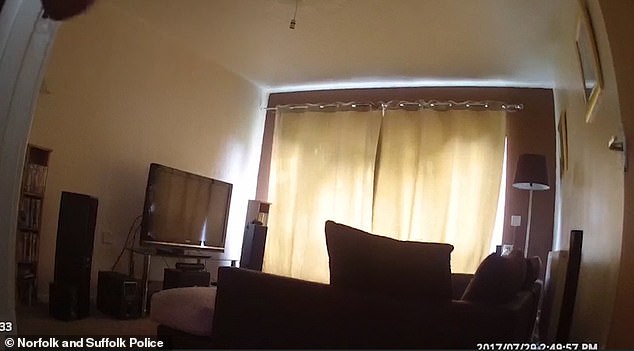
Locate an element on the screen. This screenshot has height=351, width=634. dark brown lampshade is located at coordinates (533, 163).